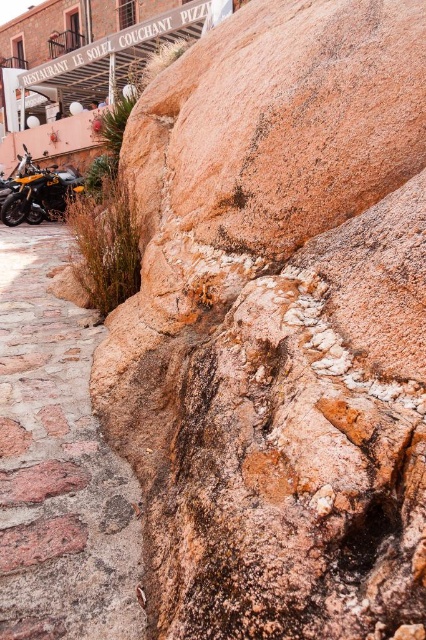
Question: Among these objects, which one is nearest to the camera?

Choices:
 (A) stone paved path at lower left
 (B) orange matte motorcycle at left

Answer: (A)

Question: Can you confirm if stone paved path at lower left is wider than orange matte motorcycle at left?

Choices:
 (A) no
 (B) yes

Answer: (B)

Question: Does stone paved path at lower left appear over orange matte motorcycle at left?

Choices:
 (A) yes
 (B) no

Answer: (B)

Question: Which point appears farthest from the camera in this image?

Choices:
 (A) (66, 380)
 (B) (40, 216)

Answer: (B)

Question: From the image, what is the correct spatial relationship of stone paved path at lower left in relation to orange matte motorcycle at left?

Choices:
 (A) left
 (B) right

Answer: (B)

Question: Which of the following is the farthest from the observer?

Choices:
 (A) orange matte motorcycle at left
 (B) stone paved path at lower left

Answer: (A)